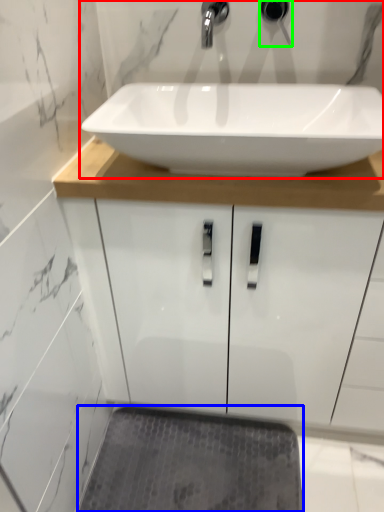
Question: Based on their relative distances, which object is nearer to sink (highlighted by a red box)? Choose from bath mat (highlighted by a blue box) and plumbing fixture (highlighted by a green box).

Choices:
 (A) bath mat
 (B) plumbing fixture

Answer: (B)